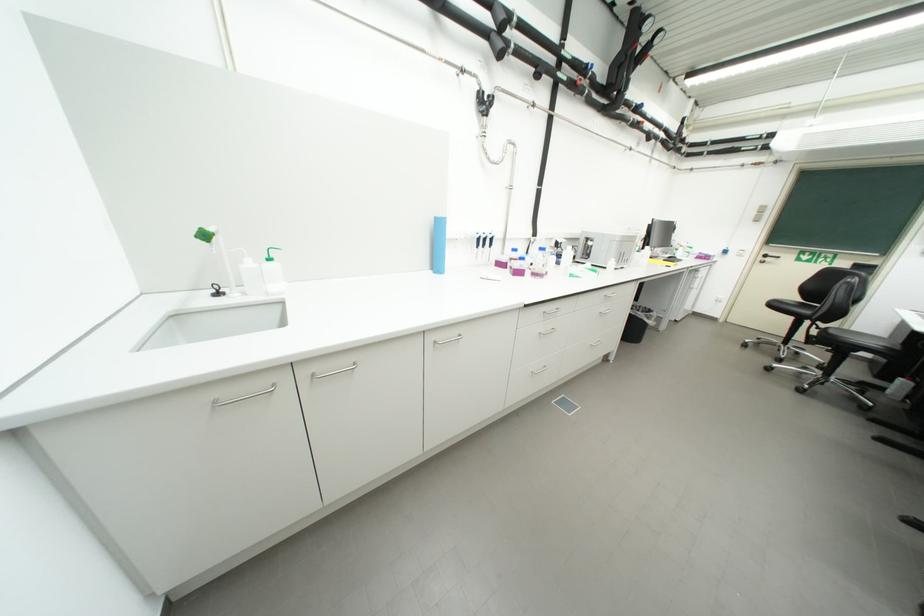
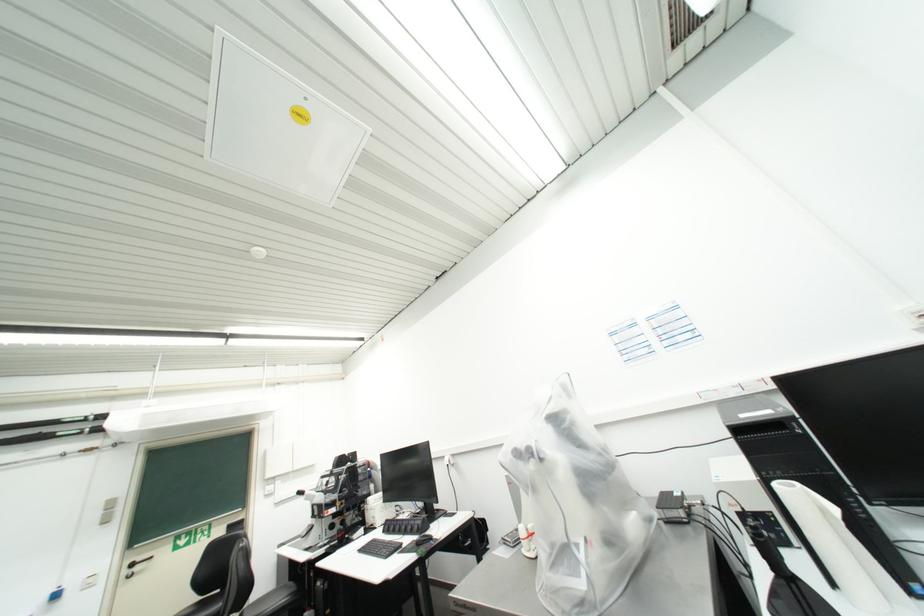
Question: The camera is either moving clockwise (left) or counter-clockwise (right) around the object. The first image is from the beginning of the video and the second image is from the end. Is the camera moving left or right when shooting the video?

Choices:
 (A) Left
 (B) Right

Answer: (A)